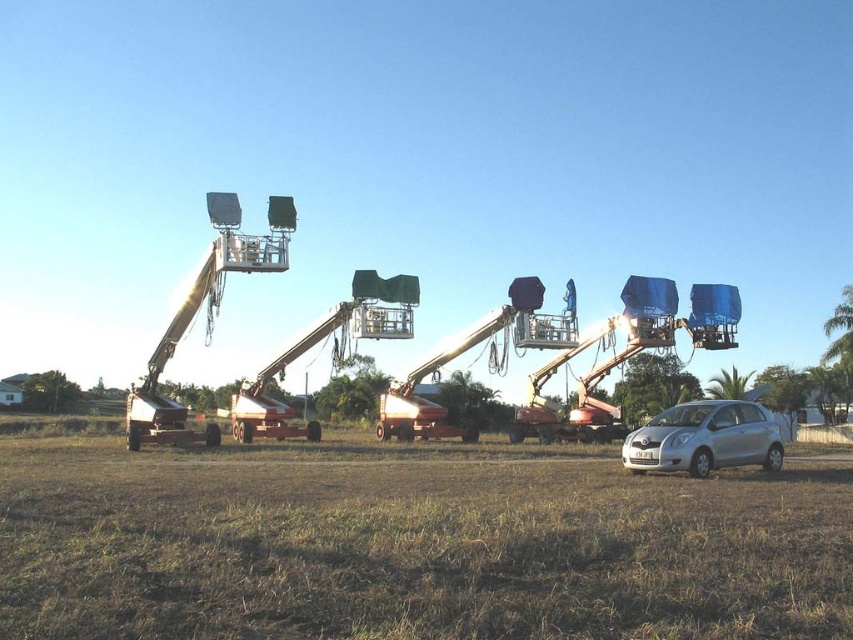
You are a delivery person trying to park your delivery van, which is 6 meters long, in the space between the brown grass at lower center and the silver metallic car at lower right. Based on the scene, can you fit your van there?

The brown grass at lower center is bigger than the silver metallic car at lower right. However, the exact dimensions of the space between them are not provided, so it is uncertain if the 6 meter van will fit. More information about the distance between the two objects is needed to determine this.

You are standing at the edge of the grassy field and want to walk to the silver metallic car at lower right. Is the brown grass at lower center between you and the car?

The brown grass at lower center is located below the silver metallic car at lower right, so it is not between you and the car. You can walk directly to the car without going through the grass.